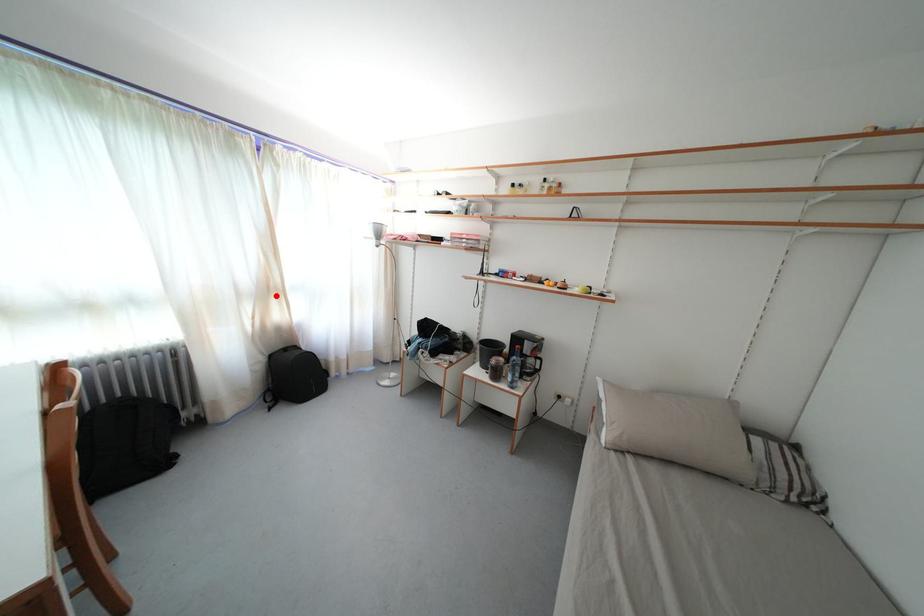
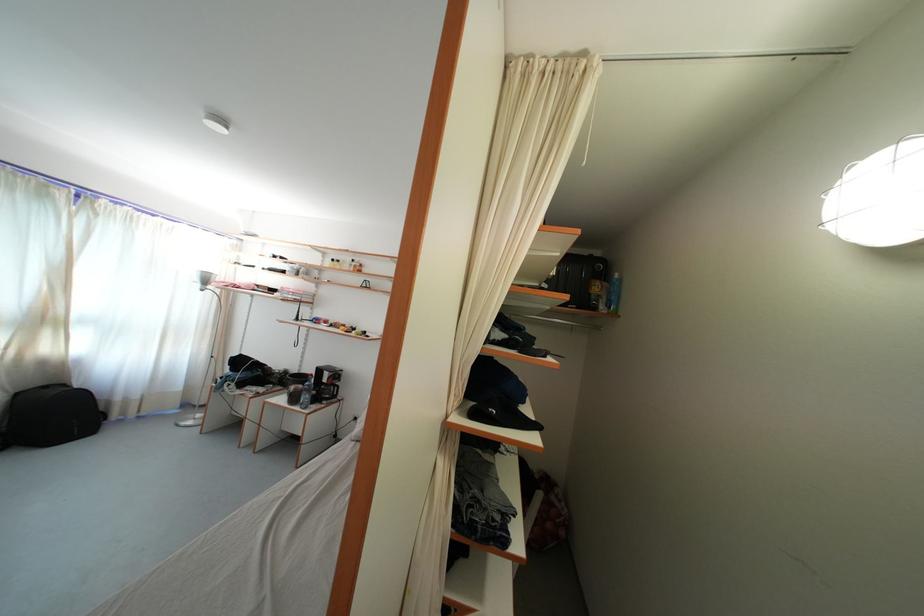
Question: I am providing you with two images of the same scene from different viewpoints. Image1 has a red point marked. In image2, the corresponding 3D location appears at what relative position? Reply with the corresponding letter.

Choices:
 (A) Closer
 (B) Farther

Answer: (A)